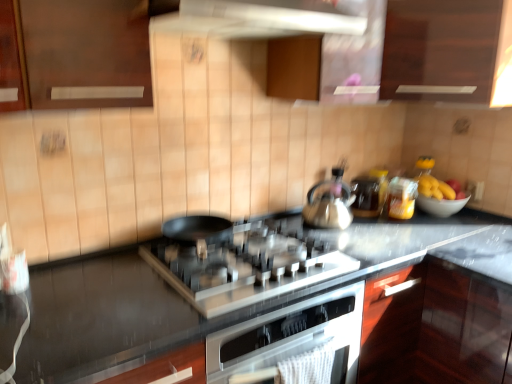
You are a GUI agent. You are given a task and a screenshot of the screen. Output one action in this format:
    pyautogui.click(x=<x>, y=<y>)
    Task: Click on the empty space that is ontop of satin silver gas stove at center (from a real-world perspective)
    The height and width of the screenshot is (384, 512).
    Given the screenshot: What is the action you would take?
    pyautogui.click(x=243, y=249)